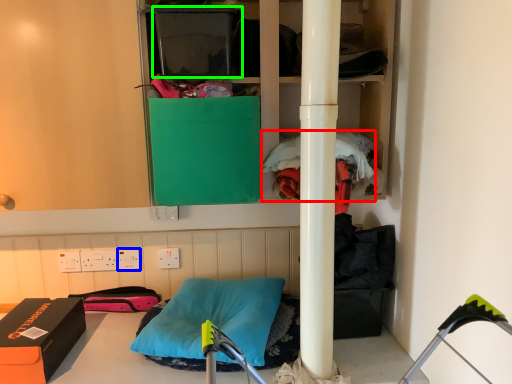
Question: Considering the real-world distances, which object is farthest from clothing (highlighted by a red box)? electric outlet (highlighted by a blue box) or box (highlighted by a green box)?

Choices:
 (A) electric outlet
 (B) box

Answer: (A)